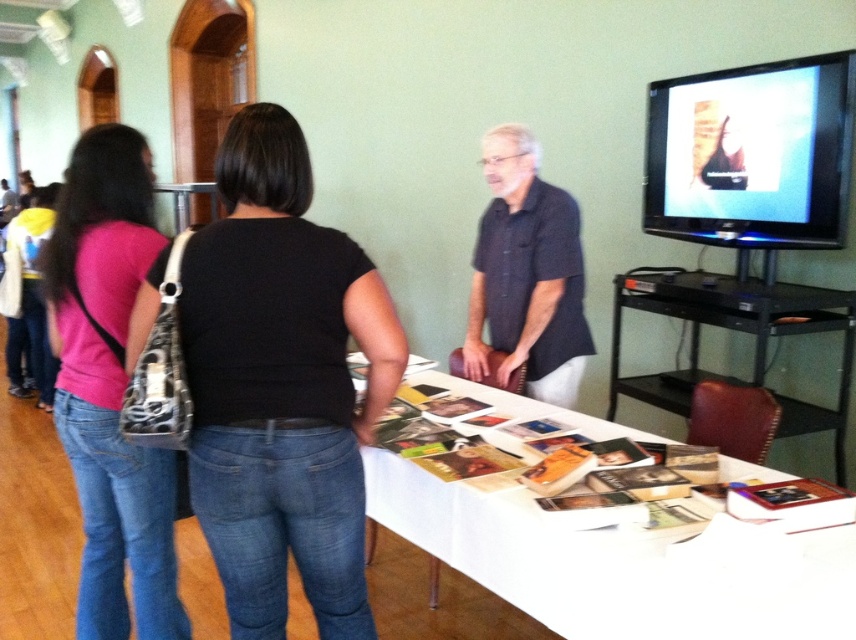
You are standing in the room and see two points marked on the wall. The first point is at coordinates point (248, 323) and the second point is at point (70, 186). Which point is closer to you?

Point (248, 323) is closer to the viewer than point (70, 186).

You are organizing a presentation and need to place a small object on the table. The white paper at center and the dark blue shirt at center are already on the table. Which item has enough space vertically to accommodate a taller object?

The dark blue shirt at center is taller than the white paper at center, so it has more vertical space and can accommodate a taller object.